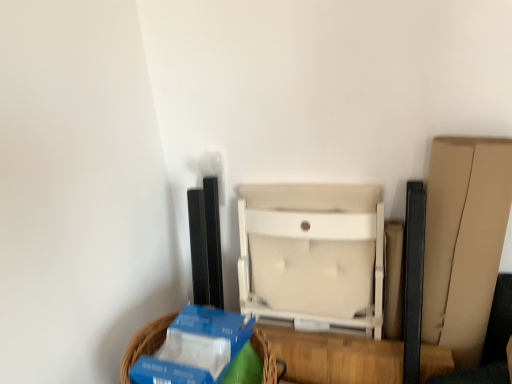
Question: Is blue cardboard basket at lower left looking in the opposite direction of beige fabric chair at center?

Choices:
 (A) no
 (B) yes

Answer: (B)

Question: Is the depth of blue cardboard basket at lower left greater than that of beige fabric chair at center?

Choices:
 (A) yes
 (B) no

Answer: (B)

Question: From a real-world perspective, is blue cardboard basket at lower left positioned over beige fabric chair at center based on gravity?

Choices:
 (A) no
 (B) yes

Answer: (B)

Question: Would you say blue cardboard basket at lower left is a long distance from beige fabric chair at center?

Choices:
 (A) yes
 (B) no

Answer: (B)

Question: From the image's perspective, is blue cardboard basket at lower left over beige fabric chair at center?

Choices:
 (A) no
 (B) yes

Answer: (A)

Question: Can you confirm if blue cardboard basket at lower left is smaller than beige fabric chair at center?

Choices:
 (A) yes
 (B) no

Answer: (A)

Question: Does beige fabric chair at center turn towards blue cardboard basket at lower left?

Choices:
 (A) yes
 (B) no

Answer: (A)

Question: Can you confirm if beige fabric chair at center is thinner than blue cardboard basket at lower left?

Choices:
 (A) yes
 (B) no

Answer: (A)

Question: From a real-world perspective, is beige fabric chair at center physically below blue cardboard basket at lower left?

Choices:
 (A) no
 (B) yes

Answer: (B)

Question: Does beige fabric chair at center have a greater width compared to blue cardboard basket at lower left?

Choices:
 (A) yes
 (B) no

Answer: (B)

Question: Are beige fabric chair at center and blue cardboard basket at lower left located far from each other?

Choices:
 (A) no
 (B) yes

Answer: (A)

Question: From the image's perspective, is beige fabric chair at center above blue cardboard basket at lower left?

Choices:
 (A) yes
 (B) no

Answer: (A)

Question: Does point (129, 357) appear closer or farther from the camera than point (355, 211)?

Choices:
 (A) closer
 (B) farther

Answer: (A)